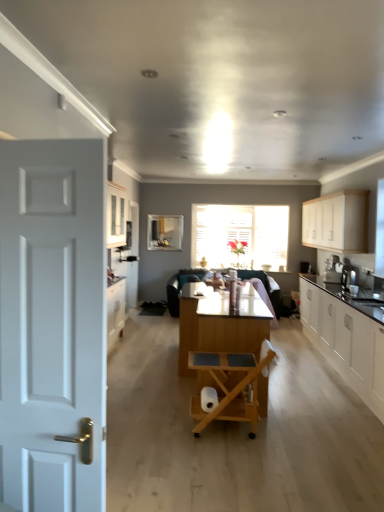
Question: From the image's perspective, is satin black coffee machine at right above clear glass window screen at center?

Choices:
 (A) yes
 (B) no

Answer: (B)

Question: Is the surface of satin black coffee machine at right in direct contact with clear glass window screen at center?

Choices:
 (A) yes
 (B) no

Answer: (B)

Question: Does satin black coffee machine at right appear on the right side of clear glass window screen at center?

Choices:
 (A) no
 (B) yes

Answer: (B)

Question: Would you say satin black coffee machine at right is outside clear glass window screen at center?

Choices:
 (A) yes
 (B) no

Answer: (A)

Question: From the image's perspective, is satin black coffee machine at right below clear glass window screen at center?

Choices:
 (A) yes
 (B) no

Answer: (A)

Question: Based on their sizes in the image, would you say wooden rolling chair at center is bigger or smaller than white matte toilet paper at center?

Choices:
 (A) big
 (B) small

Answer: (A)

Question: Considering the positions of point (198, 399) and point (215, 394), is point (198, 399) closer or farther from the camera than point (215, 394)?

Choices:
 (A) closer
 (B) farther

Answer: (A)

Question: Relative to white matte toilet paper at center, is wooden rolling chair at center in front or behind?

Choices:
 (A) behind
 (B) front

Answer: (B)

Question: In the image, is wooden rolling chair at center on the left side or the right side of white matte toilet paper at center?

Choices:
 (A) left
 (B) right

Answer: (B)

Question: Does point (x=329, y=224) appear closer or farther from the camera than point (x=352, y=281)?

Choices:
 (A) closer
 (B) farther

Answer: (B)

Question: From the image's perspective, relative to satin black coffee machine at right, is white matte cabinet at upper right, the second cabinetry when ordered from bottom to top, above or below?

Choices:
 (A) above
 (B) below

Answer: (A)

Question: In terms of size, does white matte cabinet at upper right, the second cabinetry when ordered from bottom to top, appear bigger or smaller than satin black coffee machine at right?

Choices:
 (A) big
 (B) small

Answer: (A)

Question: Considering their positions, is white matte cabinet at upper right, the second cabinetry when ordered from bottom to top, located in front of or behind satin black coffee machine at right?

Choices:
 (A) behind
 (B) front

Answer: (A)

Question: Does point (203, 411) appear closer or farther from the camera than point (360, 343)?

Choices:
 (A) closer
 (B) farther

Answer: (A)

Question: Considering the positions of white matte toilet paper at center and white glossy cabinets at right, which is the 1th cabinetry in bottom-to-top order, in the image, is white matte toilet paper at center wider or thinner than white glossy cabinets at right, which is the 1th cabinetry in bottom-to-top order,?

Choices:
 (A) wide
 (B) thin

Answer: (B)